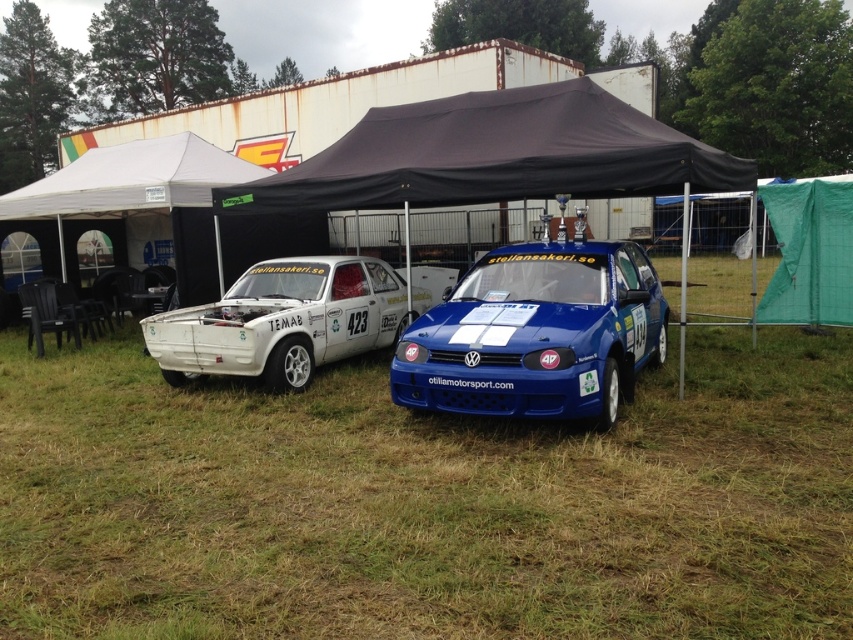
Question: Does blue glossy hatchback at center have a lesser width compared to white matte rally car at left?

Choices:
 (A) no
 (B) yes

Answer: (A)

Question: Among these objects, which one is nearest to the camera?

Choices:
 (A) white matte rally car at left
 (B) green grass at center

Answer: (B)

Question: Which point is farther from the camera taking this photo?

Choices:
 (A) (323, 467)
 (B) (561, 364)
 (C) (300, 385)

Answer: (C)

Question: Does green grass at center appear on the left side of blue glossy hatchback at center?

Choices:
 (A) yes
 (B) no

Answer: (A)

Question: Which of the following is the farthest from the observer?

Choices:
 (A) green grass at center
 (B) blue glossy hatchback at center

Answer: (B)

Question: Can you confirm if green grass at center is positioned to the right of white matte rally car at left?

Choices:
 (A) yes
 (B) no

Answer: (A)